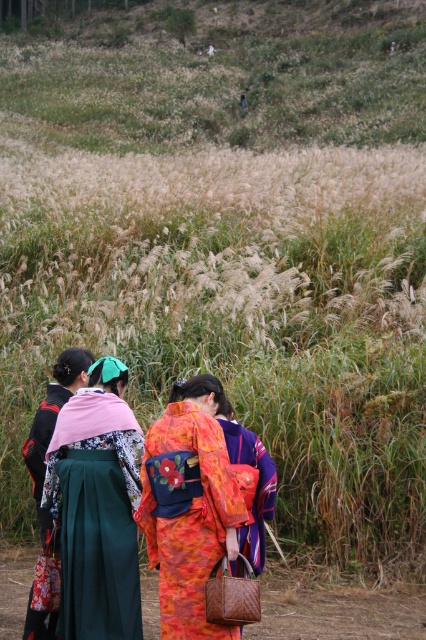
Based on the photo, in the scene with three people in traditional Japanese attire, you notice the floral kimono at center and the orange silk kimono at center. Which one is positioned to the left?

The floral kimono at center is to the left of the orange silk kimono at center.

You are a photographer planning to take a group photo of the floral kimono at center and orange silk kimono at center. To ensure both are fully visible, which kimono should be moved back slightly?

The orange silk kimono at center should be moved back slightly because the floral kimono at center is currently in front of it, blocking part of the orange silk kimono at center.